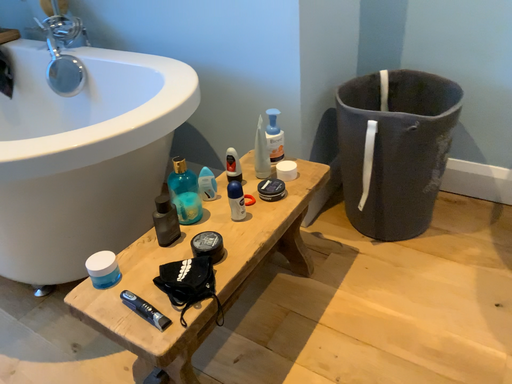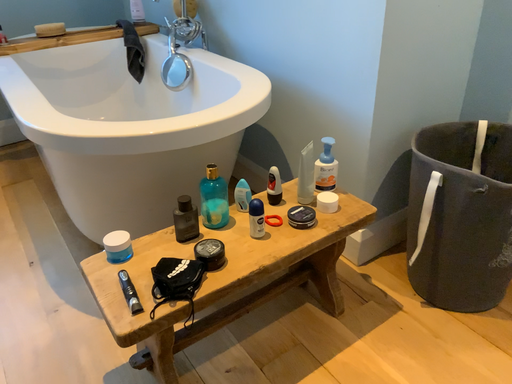
Question: How did the camera likely rotate when shooting the video?

Choices:
 (A) rotated left
 (B) rotated right

Answer: (A)